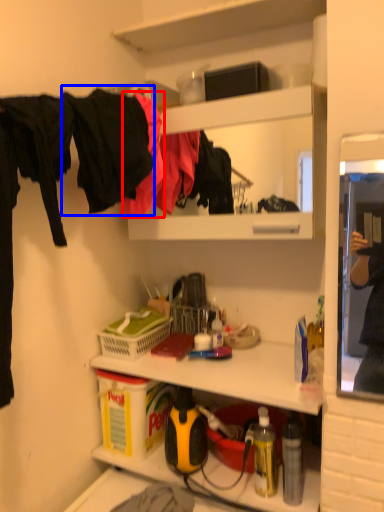
Question: Which object appears closest to the camera in this image, clothing (highlighted by a red box) or clothing (highlighted by a blue box)?

Choices:
 (A) clothing
 (B) clothing

Answer: (B)